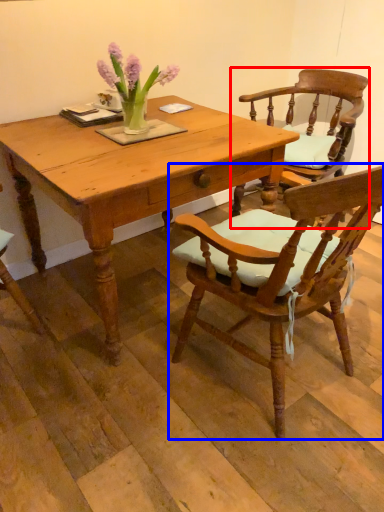
Question: Among these objects, which one is farthest to the camera, chair (highlighted by a red box) or chair (highlighted by a blue box)?

Choices:
 (A) chair
 (B) chair

Answer: (A)